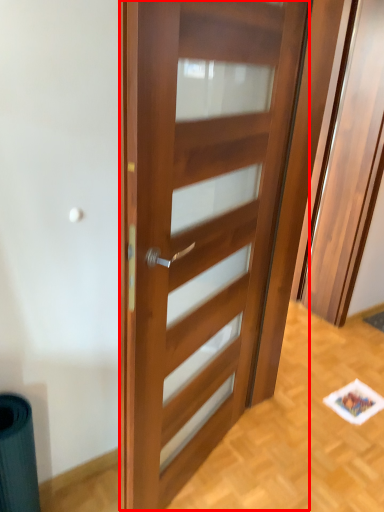
Question: From the image's perspective, considering the relative positions of door (annotated by the red box) and elevator in the image provided, where is door (annotated by the red box) located with respect to the staircase?

Choices:
 (A) above
 (B) below

Answer: (B)